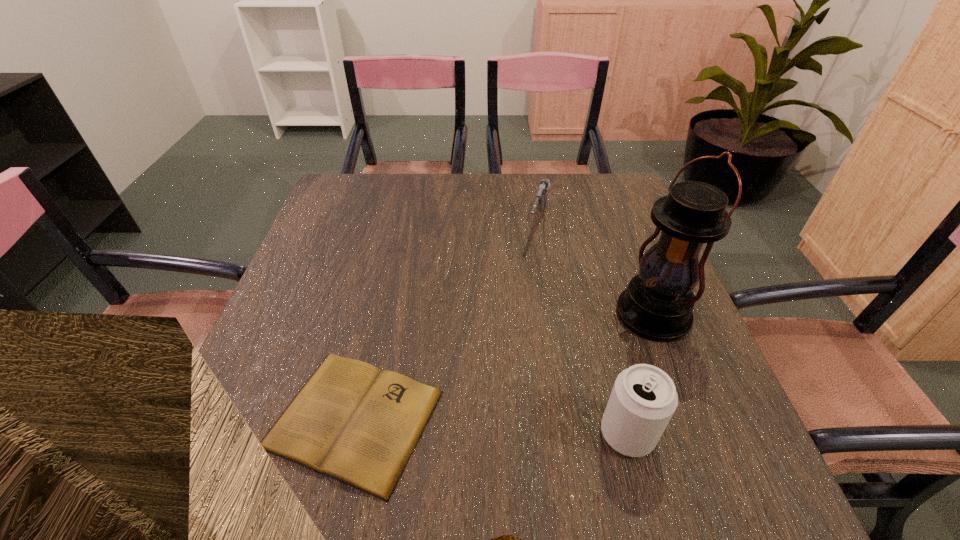
The image size is (960, 540). I want to click on vacant space that satisfies the following two spatial constraints: 1. on the front side of the book; 2. on the right side of the can, so click(350, 434).

Locate an element on the screen. Image resolution: width=960 pixels, height=540 pixels. vacant space that satisfies the following two spatial constraints: 1. on the back side of the second farthest object; 2. on the left side of the book is located at coordinates (378, 314).

Locate an element on the screen. free space that satisfies the following two spatial constraints: 1. on the back side of the lantern; 2. on the right side of the can is located at coordinates (596, 314).